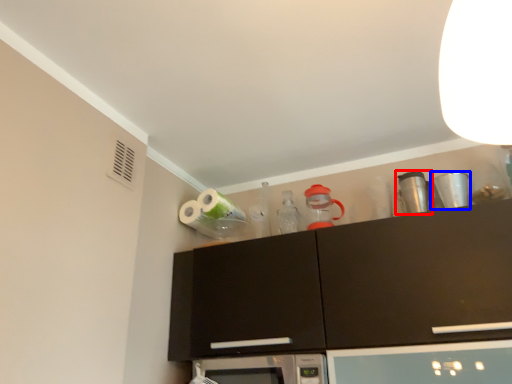
Question: Which object appears farthest to the camera in this image, appliance (highlighted by a red box) or appliance (highlighted by a blue box)?

Choices:
 (A) appliance
 (B) appliance

Answer: (A)